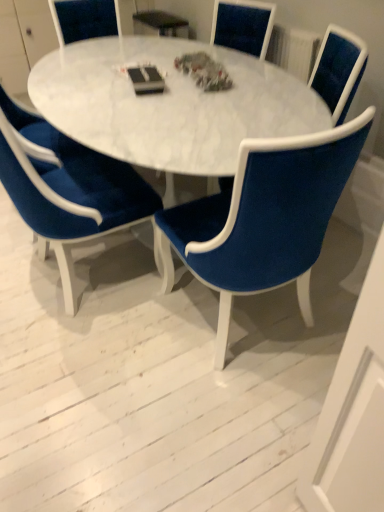
Image resolution: width=384 pixels, height=512 pixels. What do you see at coordinates (71, 196) in the screenshot?
I see `velvet blue chair at center, the first chair in the left-to-right sequence` at bounding box center [71, 196].

Describe the element at coordinates (269, 219) in the screenshot. This screenshot has height=512, width=384. I see `velvet blue chair at center, which is the 2th chair in left-to-right order` at that location.

In order to face white marble table at center, should I rotate leftwards or rightwards?

To face it directly, rotate left by 15.533 degrees.

This screenshot has width=384, height=512. I want to click on white marble table at center, so click(x=124, y=100).

Considering the sizes of velvet blue chair at center, the 2th chair from the right, and velvet blue chair at center, the first chair in the left-to-right sequence, in the image, is velvet blue chair at center, the 2th chair from the right, taller or shorter than velvet blue chair at center, the first chair in the left-to-right sequence,?

velvet blue chair at center, the 2th chair from the right, is shorter than velvet blue chair at center, the first chair in the left-to-right sequence.

Find the location of a particular element. This screenshot has width=384, height=512. chair below the velvet blue chair at center, the 3th chair when ordered from right to left (from the image's perspective) is located at coordinates (269, 219).

Are velvet blue chair at center, which is the 2th chair in left-to-right order, and velvet blue chair at center, the 3th chair when ordered from right to left, making contact?

They are not placed beside each other.

Between velvet blue chair at center, which is the 2th chair in left-to-right order, and velvet blue chair at center, the 3th chair when ordered from right to left, which one has smaller size?

velvet blue chair at center, which is the 2th chair in left-to-right order, is smaller.

Is velvet blue chair at center, the 3th chair when ordered from right to left, at the right side of white marble table at center?

In fact, velvet blue chair at center, the 3th chair when ordered from right to left, is to the left of white marble table at center.

Does velvet blue chair at center, the first chair in the left-to-right sequence, turn towards white marble table at center?

Yes, velvet blue chair at center, the first chair in the left-to-right sequence, faces towards white marble table at center.

Would you consider velvet blue chair at center, the 3th chair when ordered from right to left, to be distant from white marble table at center?

No, velvet blue chair at center, the 3th chair when ordered from right to left, is not far away from white marble table at center.

How many degrees apart are the facing directions of velvet blue chair at center, the first chair in the left-to-right sequence, and white marble table at center?

velvet blue chair at center, the first chair in the left-to-right sequence, and white marble table at center are facing 85.6 degrees away from each other.

In the scene shown: Are velvet blue chair at center, the 2th chair from the right, and velvet blue chair at center, which is the third chair from left to right, beside each other?

No, velvet blue chair at center, the 2th chair from the right, is not next to velvet blue chair at center, which is the third chair from left to right.

Is velvet blue chair at center, the 2th chair from the right, looking in the opposite direction of velvet blue chair at center, which is the third chair from left to right?

No, velvet blue chair at center, which is the third chair from left to right, is not at the back of velvet blue chair at center, the 2th chair from the right.

From the image's perspective, which one is positioned higher, velvet blue chair at center, which is the 2th chair in left-to-right order, or velvet blue chair at center, the 1th chair positioned from the right?

velvet blue chair at center, the 1th chair positioned from the right.

Considering the relative sizes of velvet blue chair at center, which is the 2th chair in left-to-right order, and velvet blue chair at center, which is the third chair from left to right, in the image provided, is velvet blue chair at center, which is the 2th chair in left-to-right order, thinner than velvet blue chair at center, which is the third chair from left to right,?

No.

In the scene shown: From the image's perspective, which one is positioned higher, white marble table at center or velvet blue chair at center, the 3th chair when ordered from right to left?

white marble table at center appears higher in the image.

Is white marble table at center closer to camera compared to velvet blue chair at center, the 3th chair when ordered from right to left?

That is False.

Based on the photo, based on their sizes in the image, would you say white marble table at center is bigger or smaller than velvet blue chair at center, the 3th chair when ordered from right to left?

white marble table at center is bigger than velvet blue chair at center, the 3th chair when ordered from right to left.

Is white marble table at center far from velvet blue chair at center, the first chair in the left-to-right sequence?

No, white marble table at center is not far from velvet blue chair at center, the first chair in the left-to-right sequence.

Considering the positions of objects white marble table at center and velvet blue chair at center, the first chair in the left-to-right sequence, in the image provided, who is in front, white marble table at center or velvet blue chair at center, the first chair in the left-to-right sequence,?

Positioned in front is white marble table at center.

Locate an element on the screen. This screenshot has width=384, height=512. chair located on the left of white marble table at center is located at coordinates (71, 196).

How different are the orientations of white marble table at center and velvet blue chair at center, the first chair in the left-to-right sequence, in degrees?

The facing directions of white marble table at center and velvet blue chair at center, the first chair in the left-to-right sequence, are 85.6 degrees apart.

Is white marble table at center with velvet blue chair at center, the 3th chair when ordered from right to left?

No, white marble table at center is not touching velvet blue chair at center, the 3th chair when ordered from right to left.

The height and width of the screenshot is (512, 384). In order to click on coffee table that appears above the velvet blue chair at center, which is the 2th chair in left-to-right order (from the image's perspective) in this screenshot , I will do `click(170, 104)`.

From their relative heights in the image, would you say velvet blue chair at center, which is the 2th chair in left-to-right order, is taller or shorter than white marble table at center?

Considering their sizes, velvet blue chair at center, which is the 2th chair in left-to-right order, has less height than white marble table at center.

Is the depth of velvet blue chair at center, the 2th chair from the right, less than that of white marble table at center?

Yes, velvet blue chair at center, the 2th chair from the right, is in front of white marble table at center.

Who is bigger, velvet blue chair at center, which is the 2th chair in left-to-right order, or white marble table at center?

Bigger between the two is white marble table at center.

Could you tell me if velvet blue chair at center, which is the third chair from left to right, is facing white marble table at center?

Yes.

Can you confirm if velvet blue chair at center, which is the third chair from left to right, is smaller than white marble table at center?

Yes.

Which object is thinner, velvet blue chair at center, the 1th chair positioned from the right, or white marble table at center?

velvet blue chair at center, the 1th chair positioned from the right.

Where is `the 1st chair positioned above the velvet blue chair at center, the 2th chair from the right (from the image's perspective)`? the 1st chair positioned above the velvet blue chair at center, the 2th chair from the right (from the image's perspective) is located at coordinates (71, 196).

Find the location of `kitchen & dining room table below the velvet blue chair at center, the 3th chair when ordered from right to left (from a real-world perspective)`. kitchen & dining room table below the velvet blue chair at center, the 3th chair when ordered from right to left (from a real-world perspective) is located at coordinates (124, 100).

From the image, which object appears to be farther from velvet blue chair at center, which is the 2th chair in left-to-right order, velvet blue chair at center, the first chair in the left-to-right sequence, or white marble table at center?

white marble table at center is further to velvet blue chair at center, which is the 2th chair in left-to-right order.

Estimate the real-world distances between objects in this image. Which object is further from velvet blue chair at center, which is the 2th chair in left-to-right order, white marble table at center or velvet blue chair at center, which is the third chair from left to right?

velvet blue chair at center, which is the third chair from left to right.

When comparing their distances from velvet blue chair at center, the 3th chair when ordered from right to left, does velvet blue chair at center, the 2th chair from the right, or white marble table at center seem closer?

white marble table at center lies closer to velvet blue chair at center, the 3th chair when ordered from right to left, than the other object.

Considering their positions, is velvet blue chair at center, the 3th chair when ordered from right to left, positioned further to velvet blue chair at center, which is the third chair from left to right, than white marble table at center?

velvet blue chair at center, the 3th chair when ordered from right to left.

Considering their positions, is white marble table at center positioned further to velvet blue chair at center, the 1th chair positioned from the right, than velvet blue chair at center, the first chair in the left-to-right sequence?

The object further to velvet blue chair at center, the 1th chair positioned from the right, is velvet blue chair at center, the first chair in the left-to-right sequence.

From the image, which object appears to be nearer to white marble table at center, velvet blue chair at center, the 2th chair from the right, or velvet blue chair at center, the 1th chair positioned from the right?

velvet blue chair at center, the 2th chair from the right.

When comparing their distances from velvet blue chair at center, the 2th chair from the right, does white marble table at center or velvet blue chair at center, the first chair in the left-to-right sequence, seem closer?

velvet blue chair at center, the first chair in the left-to-right sequence.

Based on the photo, based on their spatial positions, is white marble table at center or velvet blue chair at center, the 2th chair from the right, further from velvet blue chair at center, the first chair in the left-to-right sequence?

velvet blue chair at center, the 2th chair from the right, is further to velvet blue chair at center, the first chair in the left-to-right sequence.

Image resolution: width=384 pixels, height=512 pixels. I want to click on kitchen & dining room table between velvet blue chair at center, the first chair in the left-to-right sequence, and velvet blue chair at center, the 2th chair from the right, so click(x=124, y=100).

Image resolution: width=384 pixels, height=512 pixels. In order to click on kitchen & dining room table located between velvet blue chair at center, the first chair in the left-to-right sequence, and velvet blue chair at center, which is the third chair from left to right, in the left-right direction in this screenshot , I will do `click(124, 100)`.

Where is `kitchen & dining room table between white marble table at center and velvet blue chair at center, which is the third chair from left to right`? The height and width of the screenshot is (512, 384). kitchen & dining room table between white marble table at center and velvet blue chair at center, which is the third chair from left to right is located at coordinates (124, 100).

Locate an element on the screen. The height and width of the screenshot is (512, 384). kitchen & dining room table between white marble table at center and velvet blue chair at center, which is the 2th chair in left-to-right order, in the vertical direction is located at coordinates (124, 100).